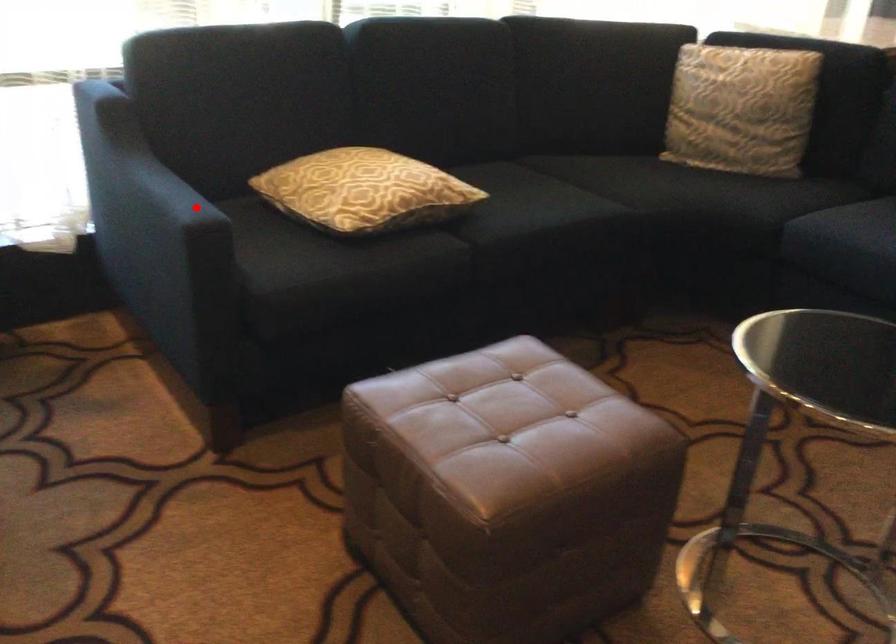
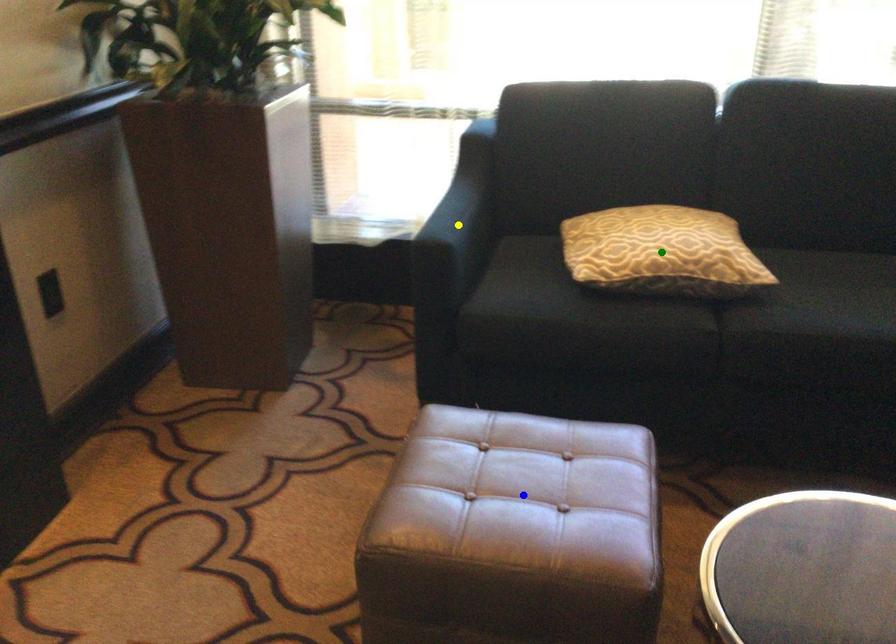
Question: I am providing you with two images of the same scene from different viewpoints. A red point is marked on the first image. You are given multiple points on the second image. Which point in image 2 is actually the same real-world point as the red point in image 1?

Choices:
 (A) green point
 (B) yellow point
 (C) blue point

Answer: (B)